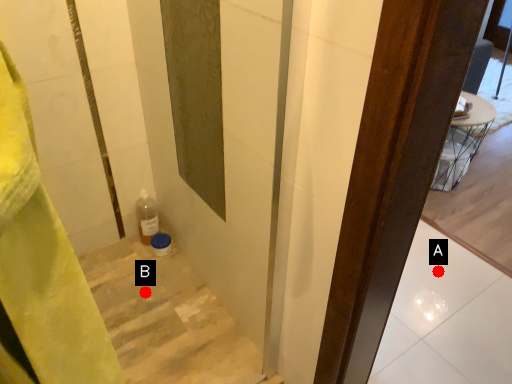
Question: Two points are circled on the image, labeled by A and B beside each circle. Which point appears farthest from the camera in this image?

Choices:
 (A) A is further
 (B) B is further

Answer: (A)